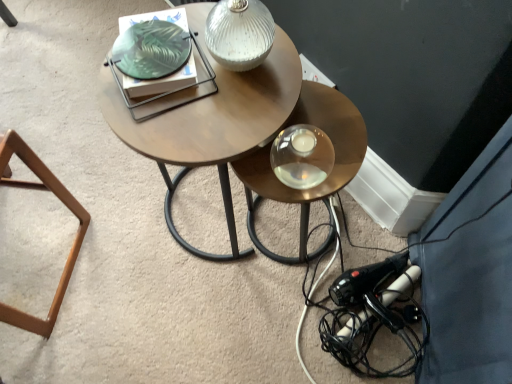
Question: Is white textured glass table lamp at upper center to the right of metallic gold table at center from the viewer's perspective?

Choices:
 (A) yes
 (B) no

Answer: (B)

Question: Does white textured glass table lamp at upper center have a greater height compared to metallic gold table at center?

Choices:
 (A) no
 (B) yes

Answer: (A)

Question: Is white textured glass table lamp at upper center turned away from metallic gold table at center?

Choices:
 (A) no
 (B) yes

Answer: (A)

Question: Is white textured glass table lamp at upper center at the left side of metallic gold table at center?

Choices:
 (A) no
 (B) yes

Answer: (B)

Question: Could you tell me if white textured glass table lamp at upper center is facing metallic gold table at center?

Choices:
 (A) yes
 (B) no

Answer: (B)

Question: Is the depth of white textured glass table lamp at upper center less than that of metallic gold table at center?

Choices:
 (A) yes
 (B) no

Answer: (A)

Question: Is brown wooden stool at lower left outside of woodenmaterial/texturecoffee table at center?

Choices:
 (A) yes
 (B) no

Answer: (A)

Question: Does brown wooden stool at lower left have a greater width compared to woodenmaterial/texturecoffee table at center?

Choices:
 (A) no
 (B) yes

Answer: (A)

Question: Considering the relative sizes of brown wooden stool at lower left and woodenmaterial/texturecoffee table at center in the image provided, is brown wooden stool at lower left smaller than woodenmaterial/texturecoffee table at center?

Choices:
 (A) no
 (B) yes

Answer: (B)

Question: Can you confirm if brown wooden stool at lower left is thinner than woodenmaterial/texturecoffee table at center?

Choices:
 (A) no
 (B) yes

Answer: (B)

Question: Can woodenmaterial/texturecoffee table at center be found inside brown wooden stool at lower left?

Choices:
 (A) no
 (B) yes

Answer: (A)

Question: From a real-world perspective, is brown wooden stool at lower left beneath woodenmaterial/texturecoffee table at center?

Choices:
 (A) yes
 (B) no

Answer: (A)

Question: Is white textured glass table lamp at upper center looking in the opposite direction of black plastic hairdryer at lower right?

Choices:
 (A) yes
 (B) no

Answer: (B)